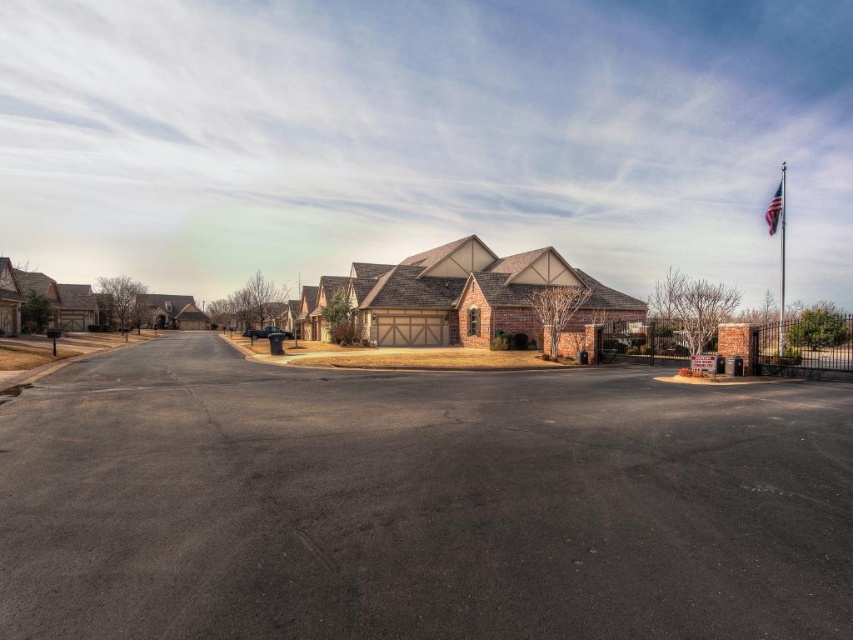
Which of these two, dark asphalt parking lot at center or metallic silver flag pole at right, stands taller?

metallic silver flag pole at right is taller.

Does dark asphalt parking lot at center come in front of metallic silver flag pole at right?

Yes.

Does point (802, 474) come farther from viewer compared to point (782, 221)?

That is False.

Where is `dark asphalt parking lot at center`? Image resolution: width=853 pixels, height=640 pixels. dark asphalt parking lot at center is located at coordinates tap(418, 504).

Which is more to the right, dark asphalt parking lot at center or american flag at upper right?

From the viewer's perspective, american flag at upper right appears more on the right side.

From the picture: Who is positioned more to the left, dark asphalt parking lot at center or american flag at upper right?

dark asphalt parking lot at center

Locate an element on the screen. dark asphalt parking lot at center is located at coordinates [x=418, y=504].

Which of these two, metallic silver flag pole at right or american flag at upper right, stands shorter?

american flag at upper right is shorter.

Does point (780, 344) come behind point (782, 196)?

No, it is not.

Image resolution: width=853 pixels, height=640 pixels. In order to click on metallic silver flag pole at right in this screenshot , I will do `click(779, 246)`.